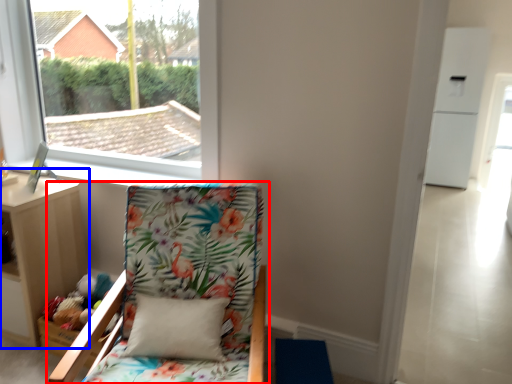
Question: Among these objects, which one is farthest to the camera, chair (highlighted by a red box) or nightstand (highlighted by a blue box)?

Choices:
 (A) chair
 (B) nightstand

Answer: (B)